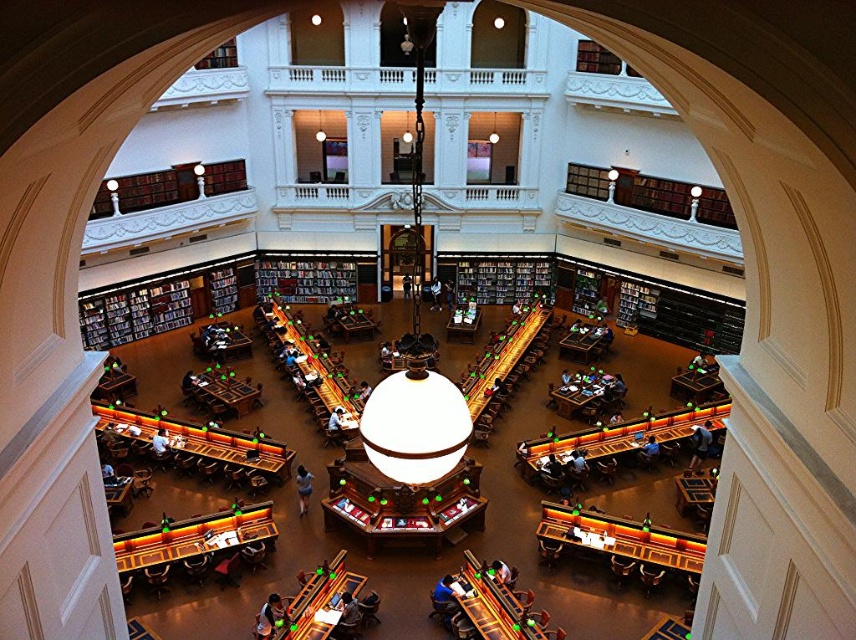
Question: Can you confirm if wooden bookshelf at left is smaller than wooden bookshelf at center?

Choices:
 (A) no
 (B) yes

Answer: (A)

Question: Which point appears closest to the camera in this image?

Choices:
 (A) (94, 305)
 (B) (337, 285)
 (C) (482, 280)

Answer: (A)

Question: Which of the following is the farthest from the observer?

Choices:
 (A) dark wood bookshelf at center
 (B) wooden bookshelf at center
 (C) wooden bookshelf at left

Answer: (B)

Question: Does wooden bookshelf at center appear on the left side of dark wood bookshelf at center?

Choices:
 (A) yes
 (B) no

Answer: (B)

Question: Can you confirm if wooden bookshelf at center is thinner than dark wood bookshelf at center?

Choices:
 (A) yes
 (B) no

Answer: (A)

Question: Based on their relative distances, which object is nearer to the wooden bookshelf at left?

Choices:
 (A) dark wood bookshelf at center
 (B) wooden bookshelf at center

Answer: (A)